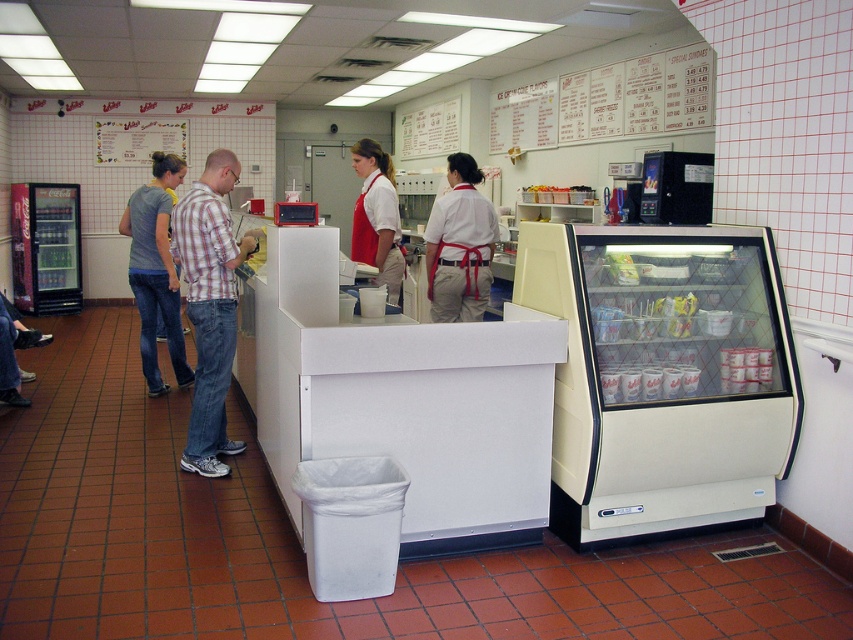
Question: Which is farther from the gray cotton shirt at left?

Choices:
 (A) plaid shirt at center
 (B) white matte shirt at center
 (C) white cotton apron at center

Answer: (C)

Question: Can you confirm if white cotton apron at center is wider than gray cotton shirt at left?

Choices:
 (A) no
 (B) yes

Answer: (A)

Question: Which point is farther from the camera taking this photo?

Choices:
 (A) (163, 189)
 (B) (390, 301)
 (C) (224, 374)

Answer: (A)

Question: Is white cotton apron at center bigger than white matte shirt at center?

Choices:
 (A) yes
 (B) no

Answer: (B)

Question: Which of these objects is positioned closest to the white cotton apron at center?

Choices:
 (A) gray cotton shirt at left
 (B) plaid shirt at center

Answer: (B)

Question: Can you confirm if gray cotton shirt at left is positioned to the left of white matte shirt at center?

Choices:
 (A) yes
 (B) no

Answer: (A)